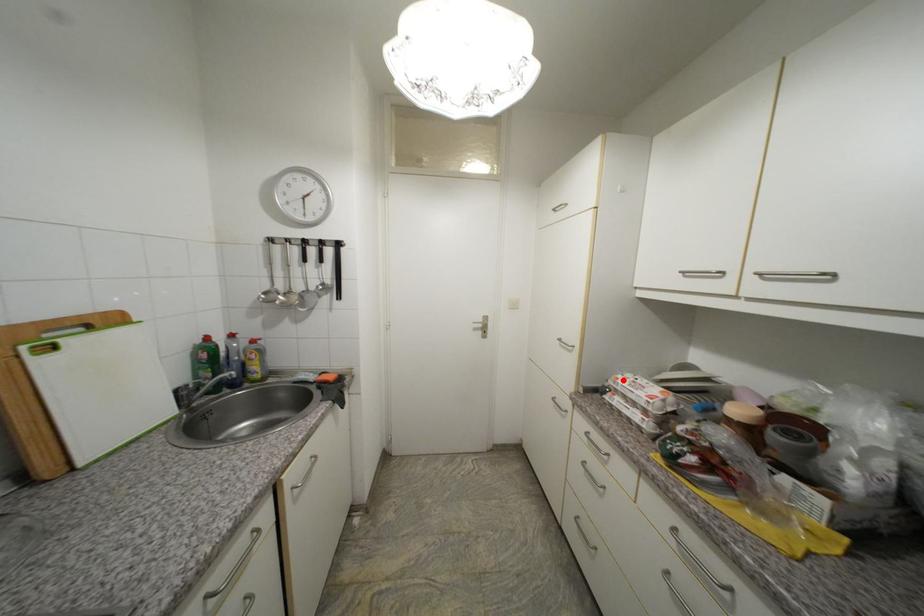
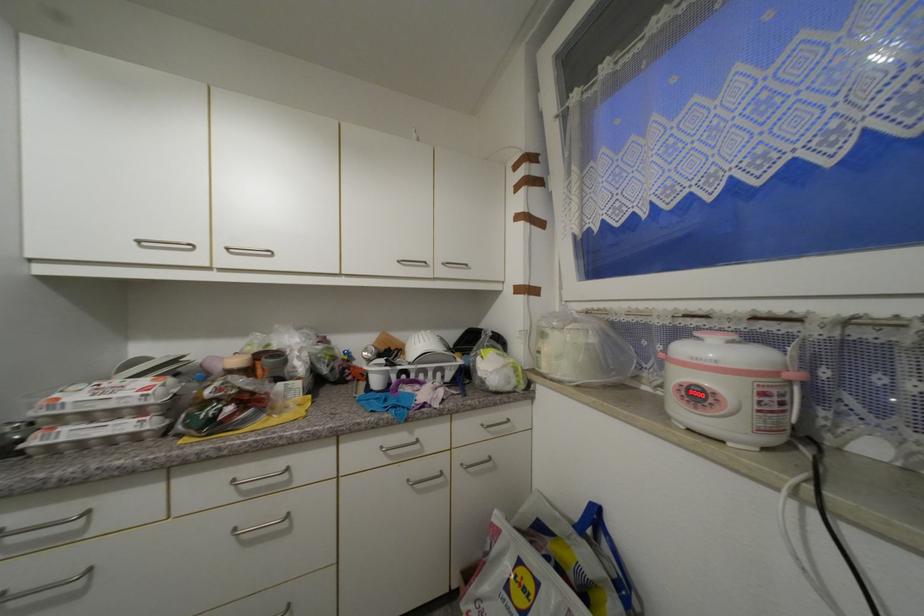
Find the pixel in the second image that matches the highlighted location in the first image.

(64, 400)